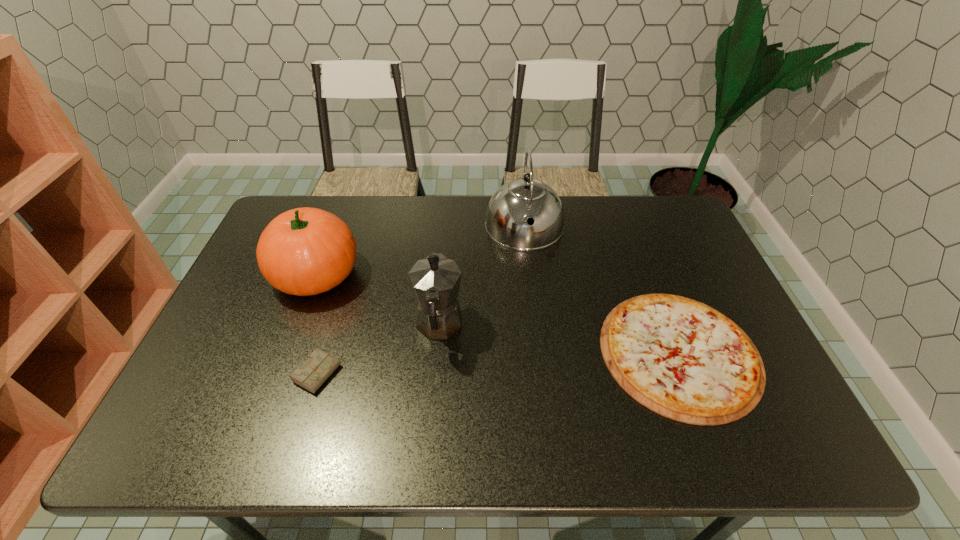
Find the location of `free location at the far right corner`. free location at the far right corner is located at coordinates (648, 235).

Image resolution: width=960 pixels, height=540 pixels. Identify the location of unoccupied position between the fourth object from left to right and the pizza. (602, 290).

Where is `unoccupied area between the rightmost object and the coffeepot`? This screenshot has width=960, height=540. unoccupied area between the rightmost object and the coffeepot is located at coordinates (559, 339).

This screenshot has width=960, height=540. I want to click on free point between the second shortest object and the third object from right to left, so click(x=378, y=350).

This screenshot has height=540, width=960. In order to click on vacant space in between the kettle and the pumpkin in this screenshot , I will do `click(420, 251)`.

Where is `free spot between the coffeepot and the pumpkin`? The width and height of the screenshot is (960, 540). free spot between the coffeepot and the pumpkin is located at coordinates (377, 300).

Identify the location of vacant point located between the third object from left to right and the rightmost object. (559, 339).

Locate an element on the screen. Image resolution: width=960 pixels, height=540 pixels. free space between the kettle and the rightmost object is located at coordinates (602, 290).

The image size is (960, 540). In order to click on free spot between the diary and the pumpkin in this screenshot , I will do `click(317, 324)`.

You are a GUI agent. You are given a task and a screenshot of the screen. Output one action in this format:
    pyautogui.click(x=<x>, y=<y>)
    Task: Click on the vacant area that lies between the diary and the rightmost object
    This screenshot has height=540, width=960.
    Given the screenshot: What is the action you would take?
    pyautogui.click(x=498, y=363)